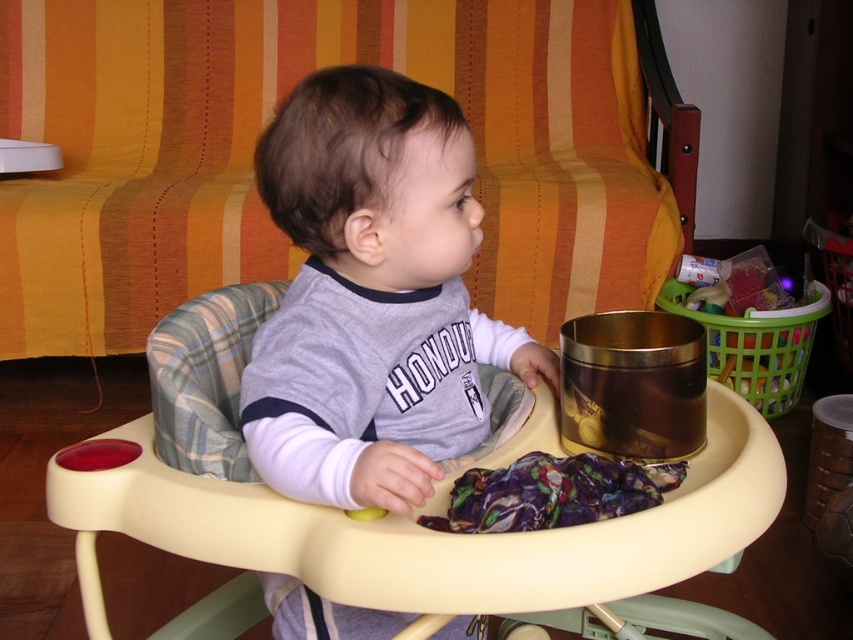
Question: From the image, what is the correct spatial relationship of beige plastic feeding chair at center in relation to purple fabric at center?

Choices:
 (A) above
 (B) below

Answer: (A)

Question: Is gray cotton shirt at center wider than purple fabric at center?

Choices:
 (A) no
 (B) yes

Answer: (B)

Question: Which object is the closest to the beige plastic feeding chair at center?

Choices:
 (A) purple fabric at center
 (B) gray cotton shirt at center

Answer: (A)

Question: Does gray cotton shirt at center have a lesser width compared to purple fabric at center?

Choices:
 (A) yes
 (B) no

Answer: (B)

Question: Which point is closer to the camera?

Choices:
 (A) (714, 541)
 (B) (599, 515)
 (C) (468, 243)

Answer: (A)

Question: Estimate the real-world distances between objects in this image. Which object is closer to the gray cotton shirt at center?

Choices:
 (A) beige plastic feeding chair at center
 (B) purple fabric at center

Answer: (A)